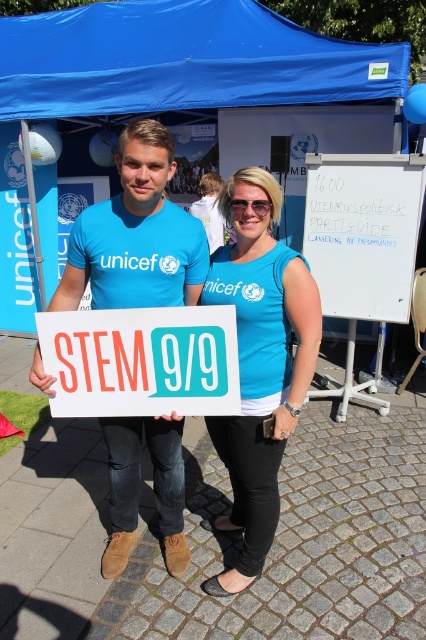
Question: Which of these objects is positioned farthest from the blue fabric canopy at upper center?

Choices:
 (A) matte blue tank top at center
 (B) blue fabric sign at center
 (C) blue fabric tent at upper center
 (D) white paper sign at center

Answer: (D)

Question: Does blue fabric canopy at upper center have a greater width compared to white paper sign at center?

Choices:
 (A) no
 (B) yes

Answer: (B)

Question: Does blue fabric sign at center have a smaller size compared to matte blue tank top at center?

Choices:
 (A) no
 (B) yes

Answer: (A)

Question: Which point is farther to the camera?

Choices:
 (A) (85, 100)
 (B) (319, 342)
 (C) (235, 241)
 (D) (169, 396)

Answer: (A)

Question: Among these objects, which one is farthest from the camera?

Choices:
 (A) blue fabric canopy at upper center
 (B) matte blue shirt at center

Answer: (B)

Question: Can you confirm if matte blue tank top at center is bigger than white paper sign at center?

Choices:
 (A) no
 (B) yes

Answer: (B)